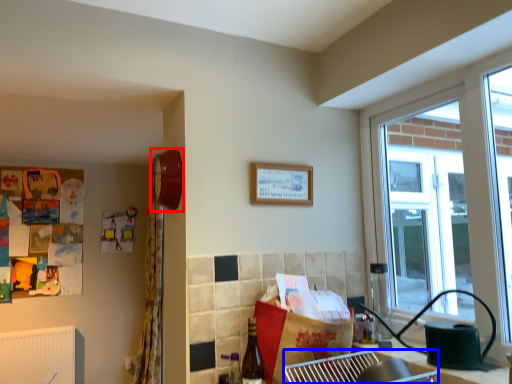
Question: Which point is further to the camera, clock (highlighted by a red box) or cabinetry (highlighted by a blue box)?

Choices:
 (A) clock
 (B) cabinetry

Answer: (A)